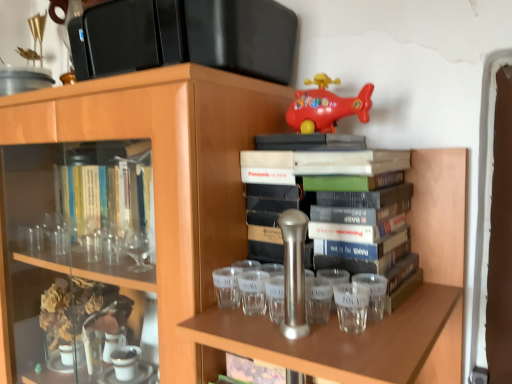
Question: Which direction should I rotate to face transparent glass shot glass at center, which ranks as the 1th shot glass in left-to-right order, — up or down?

Choices:
 (A) down
 (B) up

Answer: (A)

Question: Is transparent glass shot glass at center, which ranks as the 1th shot glass in left-to-right order, wider than hardcover book at center?

Choices:
 (A) no
 (B) yes

Answer: (A)

Question: From the image's perspective, is transparent glass shot glass at center, which ranks as the 1th shot glass in left-to-right order, under hardcover book at center?

Choices:
 (A) no
 (B) yes

Answer: (B)

Question: Is the depth of transparent glass shot glass at center, which ranks as the 1th shot glass in left-to-right order, less than that of hardcover book at center?

Choices:
 (A) no
 (B) yes

Answer: (A)

Question: Could hardcover book at center be considered to be inside transparent glass shot glass at center, which ranks as the 1th shot glass in left-to-right order?

Choices:
 (A) yes
 (B) no

Answer: (B)

Question: From the image's perspective, is transparent glass shot glass at center, the third shot glass positioned from the right, located above hardcover book at center?

Choices:
 (A) yes
 (B) no

Answer: (B)

Question: Is transparent glass shot glass at center, which ranks as the 1th shot glass in left-to-right order, located outside hardcover book at center?

Choices:
 (A) yes
 (B) no

Answer: (A)

Question: Is transparent glass shot glass at right, the first shot glass from the right, with transparent glass shot glass at center, the third shot glass positioned from the right?

Choices:
 (A) no
 (B) yes

Answer: (A)

Question: Is transparent glass shot glass at right, the first shot glass from the right, positioned beyond the bounds of transparent glass shot glass at center, which ranks as the 1th shot glass in left-to-right order?

Choices:
 (A) no
 (B) yes

Answer: (B)

Question: Can you confirm if transparent glass shot glass at right, the 3th shot glass viewed from the left, is wider than transparent glass shot glass at center, which ranks as the 1th shot glass in left-to-right order?

Choices:
 (A) yes
 (B) no

Answer: (A)

Question: Is transparent glass shot glass at right, the first shot glass from the right, bigger than transparent glass shot glass at center, the third shot glass positioned from the right?

Choices:
 (A) yes
 (B) no

Answer: (A)

Question: Does transparent glass shot glass at right, the 3th shot glass viewed from the left, have a lesser width compared to transparent glass shot glass at center, which ranks as the 1th shot glass in left-to-right order?

Choices:
 (A) no
 (B) yes

Answer: (A)

Question: From a real-world perspective, is transparent glass shot glass at right, the 3th shot glass viewed from the left, physically below transparent glass shot glass at center, the third shot glass positioned from the right?

Choices:
 (A) yes
 (B) no

Answer: (B)

Question: From the image's perspective, is transparent glass shot glass at center, which ranks as the 1th shot glass in left-to-right order, beneath transparent glass shot glass at right, the 3th shot glass viewed from the left?

Choices:
 (A) no
 (B) yes

Answer: (A)